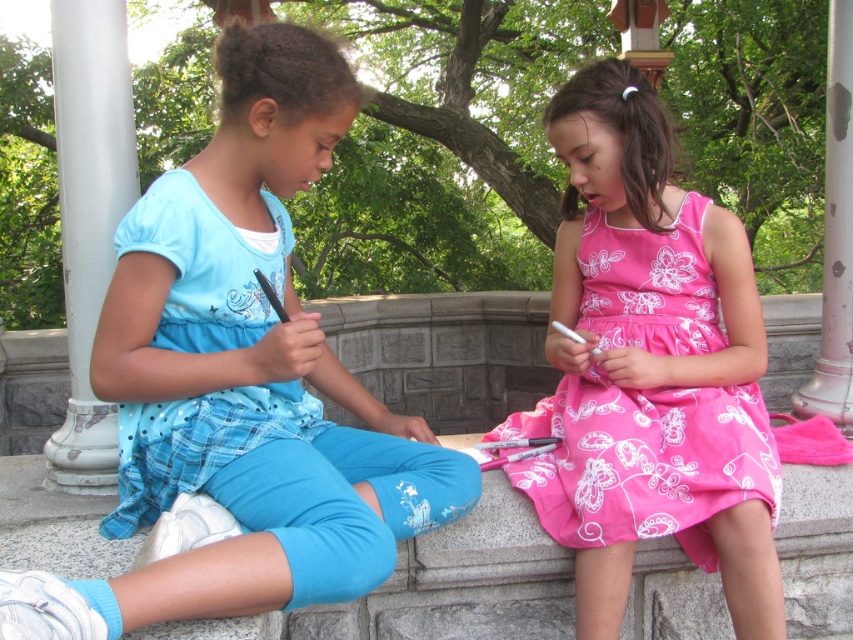
Question: Which of the following is the closest to the observer?

Choices:
 (A) (519, 468)
 (B) (234, 285)

Answer: (B)

Question: Does matte blue pants at center have a larger size compared to pink floral dress at center?

Choices:
 (A) no
 (B) yes

Answer: (B)

Question: Which point is closer to the camera?

Choices:
 (A) (721, 490)
 (B) (64, 582)

Answer: (B)

Question: Is matte blue pants at center wider than pink floral dress at center?

Choices:
 (A) yes
 (B) no

Answer: (A)

Question: Does matte blue pants at center appear over pink floral dress at center?

Choices:
 (A) yes
 (B) no

Answer: (A)